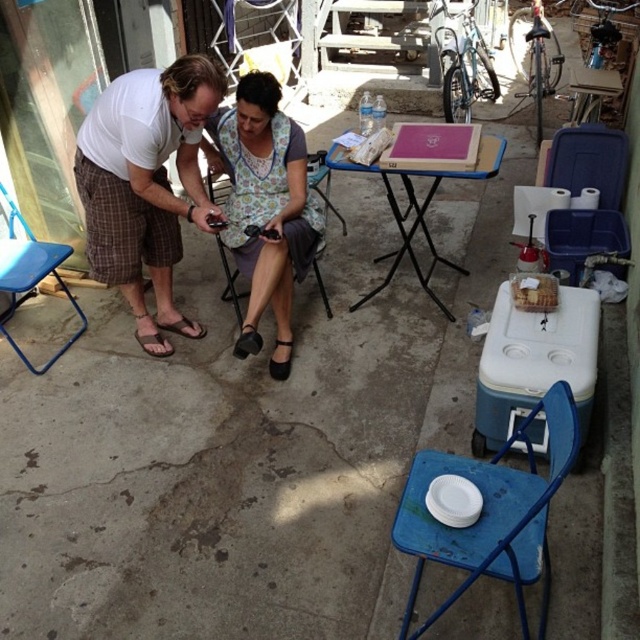
Question: Which object is closer to the camera taking this photo?

Choices:
 (A) floral fabric dress at center
 (B) blue metal folding chair at lower right

Answer: (B)

Question: Among these objects, which one is nearest to the camera?

Choices:
 (A) black leather shoe at lower center
 (B) wooden board at center
 (C) black leather sandal at lower center

Answer: (C)

Question: Is wooden board at center smaller than blue plastic folding chair at left?

Choices:
 (A) no
 (B) yes

Answer: (A)

Question: In this image, where is blue metal folding chair at lower right located relative to blue plastic folding chair at left?

Choices:
 (A) below
 (B) above

Answer: (A)

Question: Which object is positioned closest to the wooden board at center?

Choices:
 (A) white t-shirt at left
 (B) brown leather sandal at lower left
 (C) blue plastic folding chair at left

Answer: (A)

Question: Can you confirm if floral fabric dress at center is thinner than black leather shoe at lower center?

Choices:
 (A) no
 (B) yes

Answer: (A)